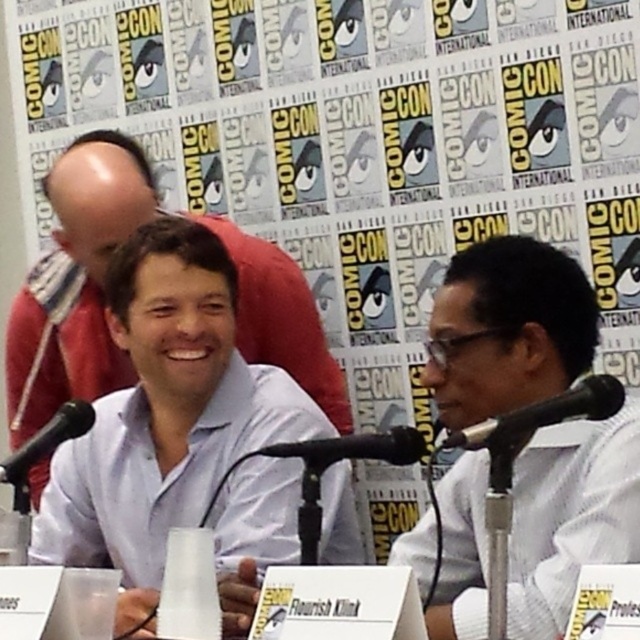
Does point (522, 344) come closer to viewer compared to point (6, 464)?

No, it is not.

Is white textured shirt at right smaller than black matte microphone at left?

No, white textured shirt at right is not smaller than black matte microphone at left.

The height and width of the screenshot is (640, 640). Describe the element at coordinates (508, 328) in the screenshot. I see `white textured shirt at right` at that location.

At what (x,y) coordinates should I click in order to perform the action: click on white textured shirt at right. Please return your answer as a coordinate pair (x, y). The height and width of the screenshot is (640, 640). Looking at the image, I should click on (508, 328).

Does black plastic microphone at center appear under black matte microphone at left?

No, black plastic microphone at center is not below black matte microphone at left.

Is black plastic microphone at center bigger than black matte microphone at left?

Incorrect, black plastic microphone at center is not larger than black matte microphone at left.

The image size is (640, 640). What do you see at coordinates (353, 449) in the screenshot? I see `black plastic microphone at center` at bounding box center [353, 449].

Where is `black plastic microphone at center`? black plastic microphone at center is located at coordinates (353, 449).

Does white textured shirt at right have a greater height compared to black matte microphone at center?

Correct, white textured shirt at right is much taller as black matte microphone at center.

Does point (605, 544) come behind point (518, 442)?

Yes, it is behind point (518, 442).

Find the location of a particular element. white textured shirt at right is located at coordinates pyautogui.click(x=508, y=328).